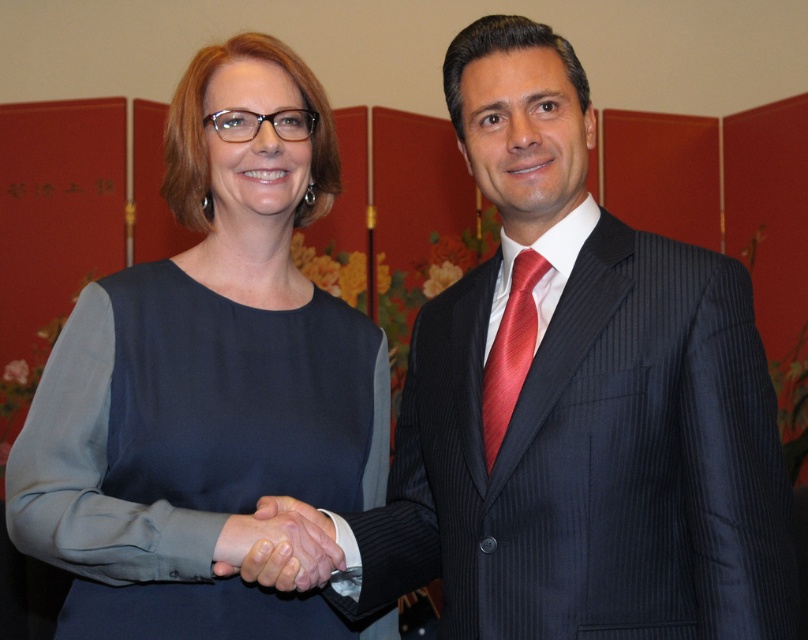
You are a photographer adjusting the lighting for a formal event. You notice the smooth black suit at center and the shiny red tie at center in the frame. Which object should you focus on first if you want to ensure the larger one is properly lit?

The smooth black suit at center is larger in size than the shiny red tie at center, so you should focus on the smooth black suit at center first to ensure proper lighting.

You are a photographer standing 1.5 meters away from the scene. You want to take a closeup photo of the matte black dress at center without moving the subjects. Is it possible to do so without moving the dress?

The matte black dress at center is 1.08 meters away from the viewer. Since you are standing 1.5 meters away from the scene, the dress is closer than your current position. To take a closeup, you would need to move 0.42 meters closer to the dress to capture it without moving the subjects.

You are a photographer taking a picture of the two people shaking hands. You notice the matte black dress at center and the shiny red tie at center. Which object is positioned higher in the image?

The matte black dress at center is taller than the shiny red tie at center, so the matte black dress at center is positioned higher in the image.